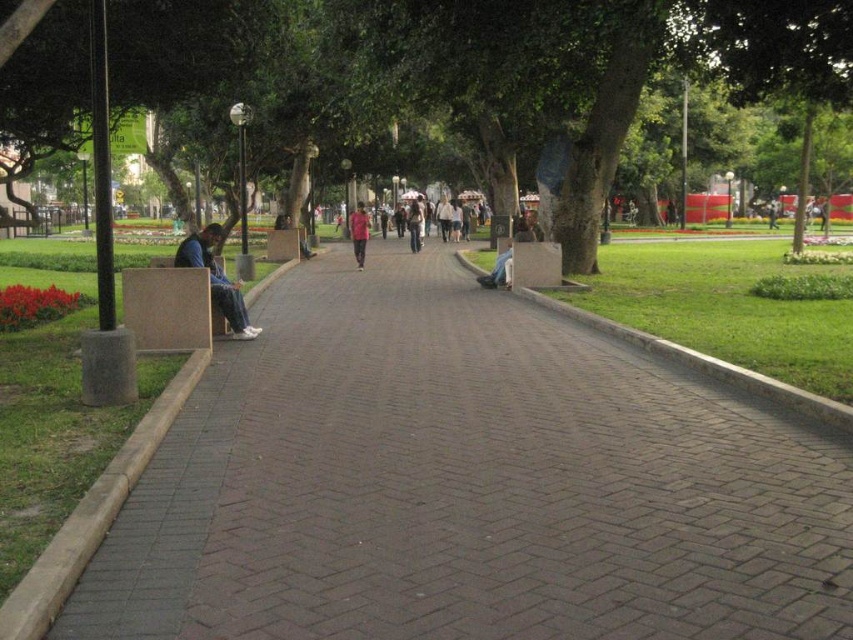
You are a park visitor who wants to sit on the light brown leather jacket at center. However, there is an obstacle blocking your path. Based on the scene description, can you determine if the dark blue jeans at left is an obstacle in your way?

The dark blue jeans at left is located below the light brown leather jacket at center, which means it is positioned lower and likely not blocking the path to the jacket. Therefore, the dark blue jeans at left is not an obstacle in your way.

You are a park visitor trying to sit on the raised concrete planter on the left side of the path. The planter can only accommodate items up to the width of the light brown leather jacket at center. Can the dark blue jeans at left fit on the planter?

The dark blue jeans at left is wider than the light brown leather jacket at center. Since the planter can only accommodate items up to the width of the light brown leather jacket at center, the dark blue jeans at left cannot fit on the planter.